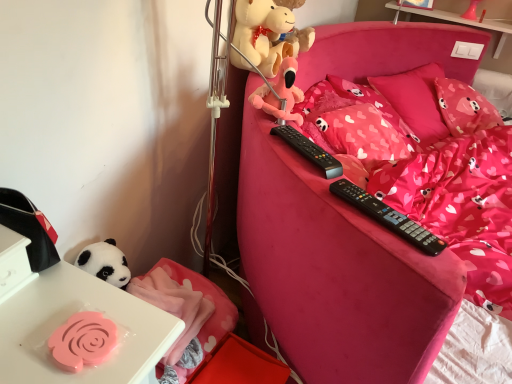
Question: From the image's perspective, does matte pink plush at upper center appear lower than pink fabric pillow at upper right, the second pillow positioned from the left?

Choices:
 (A) no
 (B) yes

Answer: (B)

Question: From a real-world perspective, is matte pink plush at upper center on pink fabric pillow at upper right, the second pillow positioned from the left?

Choices:
 (A) yes
 (B) no

Answer: (A)

Question: Is matte pink plush at upper center located outside pink fabric pillow at upper right, the 1th pillow viewed from the right?

Choices:
 (A) yes
 (B) no

Answer: (A)

Question: Is matte pink plush at upper center behind pink fabric pillow at upper right, the second pillow positioned from the left?

Choices:
 (A) yes
 (B) no

Answer: (B)

Question: Does matte pink plush at upper center have a smaller size compared to pink fabric pillow at upper right, the 1th pillow viewed from the right?

Choices:
 (A) no
 (B) yes

Answer: (B)

Question: Considering the relative sizes of matte pink plush at upper center and pink fabric pillow at upper right, the second pillow positioned from the left, in the image provided, is matte pink plush at upper center shorter than pink fabric pillow at upper right, the second pillow positioned from the left,?

Choices:
 (A) no
 (B) yes

Answer: (B)

Question: From a real-world perspective, is pink fabric pillow at upper right, the second pillow positioned from the left, over pink fabric pillow at upper right, which is the 2th pillow from right to left?

Choices:
 (A) yes
 (B) no

Answer: (B)

Question: From a real-world perspective, is pink fabric pillow at upper right, the 1th pillow viewed from the right, below pink fabric pillow at upper right, positioned as the 1th pillow in left-to-right order?

Choices:
 (A) no
 (B) yes

Answer: (B)

Question: Is pink fabric pillow at upper right, the second pillow positioned from the left, facing towards pink fabric pillow at upper right, positioned as the 1th pillow in left-to-right order?

Choices:
 (A) yes
 (B) no

Answer: (A)

Question: Is pink fabric pillow at upper right, the 1th pillow viewed from the right, not within pink fabric pillow at upper right, positioned as the 1th pillow in left-to-right order?

Choices:
 (A) yes
 (B) no

Answer: (B)

Question: Is pink fabric pillow at upper right, the second pillow positioned from the left, touching pink fabric pillow at upper right, which is the 2th pillow from right to left?

Choices:
 (A) yes
 (B) no

Answer: (B)

Question: Is pink fabric pillow at upper right, the 1th pillow viewed from the right, bigger than pink fabric pillow at upper right, which is the 2th pillow from right to left?

Choices:
 (A) yes
 (B) no

Answer: (B)

Question: From a real-world perspective, is pink fabric pillow at upper right, positioned as the 1th pillow in left-to-right order, physically above white glossy table at upper right?

Choices:
 (A) yes
 (B) no

Answer: (B)